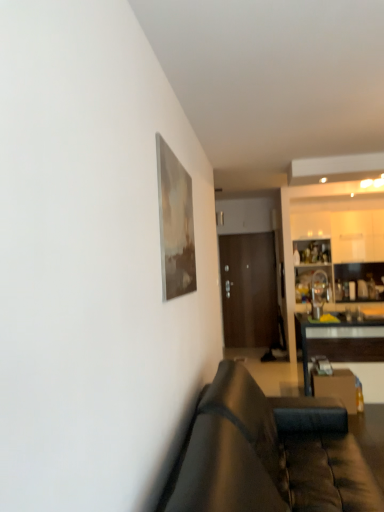
What is the approximate width of white glossy cabinetry at right?

white glossy cabinetry at right is 0.95 inches in width.

Identify the location of brown wooden door at center. The width and height of the screenshot is (384, 512). (249, 290).

From the image's perspective, between brown wooden door at center and black glossy table at right, which one is located above?

brown wooden door at center is shown above in the image.

Considering the relative sizes of brown wooden door at center and black glossy table at right in the image provided, is brown wooden door at center shorter than black glossy table at right?

No, brown wooden door at center is not shorter than black glossy table at right.

Considering the positions of objects brown wooden door at center and black glossy table at right in the image provided, who is more to the left, brown wooden door at center or black glossy table at right?

brown wooden door at center is more to the left.

From the image's perspective, which object appears higher, white glossy cabinetry at right or black glossy table at right?

white glossy cabinetry at right, from the image's perspective.

Relative to black glossy table at right, is white glossy cabinetry at right in front or behind?

white glossy cabinetry at right is behind black glossy table at right.

How different are the orientations of white glossy cabinetry at right and black glossy table at right in degrees?

0.703 degrees.

Considering the sizes of objects white glossy cabinetry at right and black glossy table at right in the image provided, who is bigger, white glossy cabinetry at right or black glossy table at right?

Bigger between the two is black glossy table at right.

In terms of width, does white glossy cabinetry at right look wider or thinner when compared to brown wooden door at center?

Clearly, white glossy cabinetry at right has less width compared to brown wooden door at center.

From the image's perspective, which one is positioned lower, white glossy cabinetry at right or brown wooden door at center?

brown wooden door at center, from the image's perspective.

Can you tell me how much black glossy table at right and brown wooden door at center differ in facing direction?

black glossy table at right and brown wooden door at center are facing 0.616 degrees away from each other.

Are black glossy table at right and brown wooden door at center beside each other?

No, black glossy table at right is not in contact with brown wooden door at center.

Considering the positions of objects black glossy table at right and brown wooden door at center in the image provided, who is more to the left, black glossy table at right or brown wooden door at center?

From the viewer's perspective, brown wooden door at center appears more on the left side.

From the image's perspective, is leather couch at lower right above brown wooden door at center?

Actually, leather couch at lower right appears below brown wooden door at center in the image.

Which object is wider, leather couch at lower right or brown wooden door at center?

Wider between the two is leather couch at lower right.

Considering the relative positions of leather couch at lower right and brown wooden door at center in the image provided, is leather couch at lower right to the right of brown wooden door at center from the viewer's perspective?

No.

Is the position of leather couch at lower right less distant than that of brown wooden door at center?

Yes.

Which of these two, black glossy table at right or white glossy cabinetry at right, stands taller?

white glossy cabinetry at right is taller.

Identify the location of cabinetry positioned vertically above the black glossy table at right (from a real-world perspective). The width and height of the screenshot is (384, 512). (343, 233).

Is white glossy cabinetry at right at the back of black glossy table at right?

→ Yes, black glossy table at right's orientation is away from white glossy cabinetry at right.

Between black glossy table at right and white glossy cabinetry at right, which one has smaller size?

With smaller size is white glossy cabinetry at right.

Which is behind, point (325, 341) or point (228, 453)?

The point (325, 341) is more distant.

Based on the photo, from a real-world perspective, relative to leather couch at lower right, is black glossy table at right vertically above or below?

From a real-world perspective, black glossy table at right is physically below leather couch at lower right.

Between black glossy table at right and leather couch at lower right, which one has larger width?

leather couch at lower right is wider.

Find the location of a particular element. This screenshot has width=384, height=512. table in front of the brown wooden door at center is located at coordinates (339, 342).

Image resolution: width=384 pixels, height=512 pixels. I want to click on cabinetry that appears behind the black glossy table at right, so [x=343, y=233].

Which object lies further to the anchor point white glossy cabinetry at right, brown wooden door at center or leather couch at lower right?

Based on the image, leather couch at lower right appears to be further to white glossy cabinetry at right.

From the image, which object appears to be nearer to black glossy table at right, leather couch at lower right or brown wooden door at center?

The object closer to black glossy table at right is leather couch at lower right.

From the picture: From the image, which object appears to be nearer to brown wooden door at center, leather couch at lower right or white glossy cabinetry at right?

white glossy cabinetry at right.

Looking at the image, which one is located further to brown wooden door at center, white glossy cabinetry at right or black glossy table at right?

black glossy table at right is further to brown wooden door at center.

When comparing their distances from leather couch at lower right, does white glossy cabinetry at right or black glossy table at right seem closer?

black glossy table at right lies closer to leather couch at lower right than the other object.

From the image, which object appears to be farther from leather couch at lower right, white glossy cabinetry at right or brown wooden door at center?

Among the two, brown wooden door at center is located further to leather couch at lower right.

Which object lies nearer to the anchor point white glossy cabinetry at right, leather couch at lower right or brown wooden door at center?

The object closer to white glossy cabinetry at right is brown wooden door at center.

Based on their spatial positions, is black glossy table at right or white glossy cabinetry at right closer to leather couch at lower right?

The object closer to leather couch at lower right is black glossy table at right.

This screenshot has height=512, width=384. I want to click on cabinetry located between leather couch at lower right and brown wooden door at center in the depth direction, so click(x=343, y=233).

Identify the location of cabinetry between black glossy table at right and brown wooden door at center in the front-back direction. (343, 233).

Find the location of a particular element. The width and height of the screenshot is (384, 512). table between leather couch at lower right and white glossy cabinetry at right from front to back is located at coordinates (339, 342).

The width and height of the screenshot is (384, 512). In order to click on table between leather couch at lower right and brown wooden door at center in the front-back direction in this screenshot , I will do `click(339, 342)`.